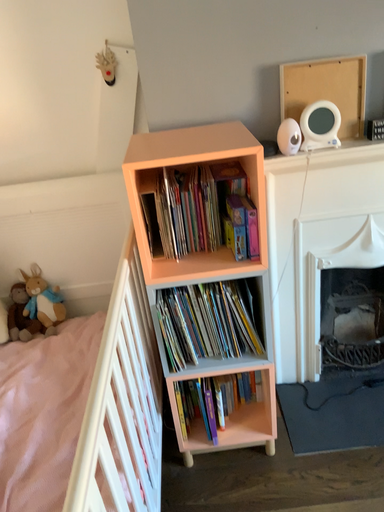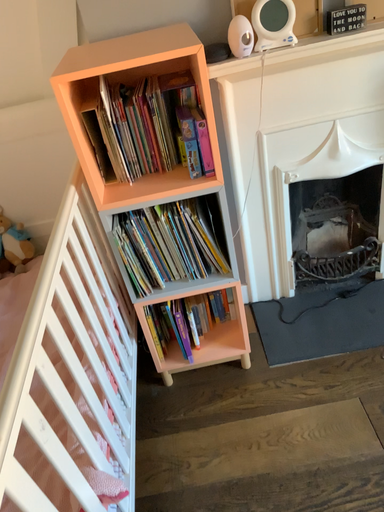
Question: How did the camera likely rotate when shooting the video?

Choices:
 (A) rotated downward
 (B) rotated upward

Answer: (A)